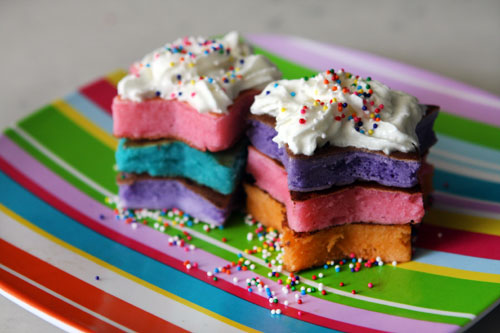
Find the location of a particular element. Image resolution: width=500 pixels, height=333 pixels. table is located at coordinates click(102, 41).